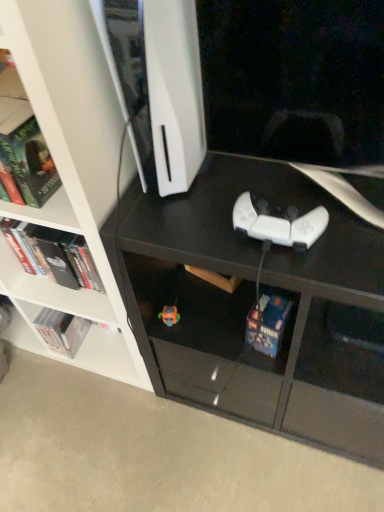
At what (x,y) coordinates should I click in order to perform the action: click on free space in front of white matte game controller at center. Please return your answer as a coordinate pair (x, y). The height and width of the screenshot is (512, 384). Looking at the image, I should click on (307, 267).